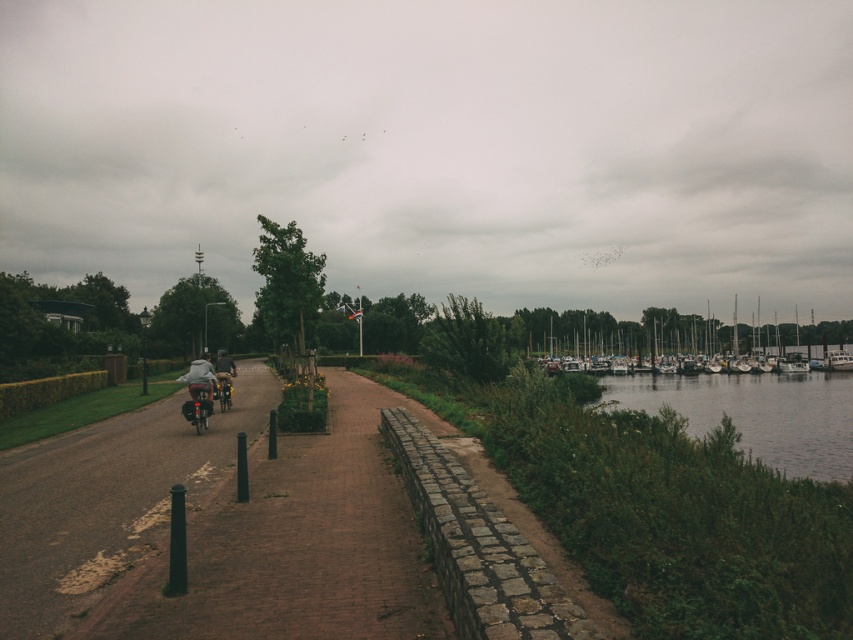
You are a pedestrian standing on the paved pathway and want to cross the river. The white matte boats at right and the matte gray jacket at left are in your path. Which object is on the right side of the other?

The white matte boats at right is positioned on the right side of matte gray jacket at left, so the white matte boats at right is on the right side of the matte gray jacket at left.